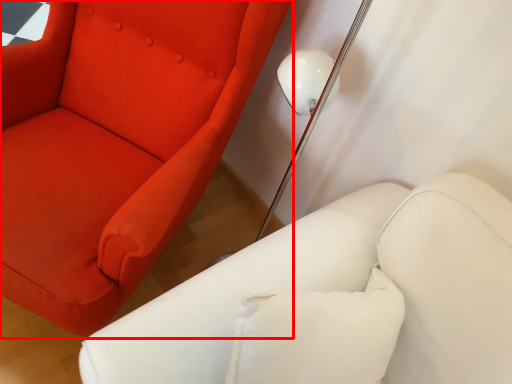
Question: Considering the relative positions of chair (annotated by the red box) and furniture in the image provided, where is chair (annotated by the red box) located with respect to the staircase?

Choices:
 (A) right
 (B) left

Answer: (B)